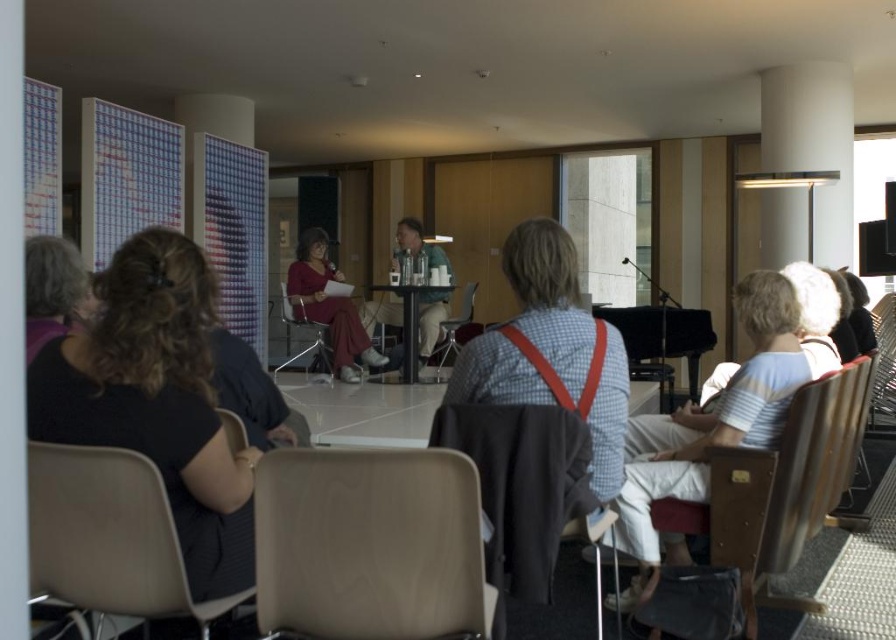
You are an event organizer who needs to adjust the seating arrangement for the panelists. You want to place a new table between the metallic silver chair at center and the matte plastic chair at center. Is this possible?

The metallic silver chair at center is positioned under the matte plastic chair at center, so placing a table between them might not be feasible since they are vertically aligned rather than horizontally spaced apart.

You are a stagehand needing to move a 1.5 meter long extension cord from the black fabric shirt at left to the wooden chair at lower right. Can you lay the cord directly on the floor between them without bending it?

The distance between the black fabric shirt at left and the wooden chair at lower right is 2.03 meters. Since the extension cord is 1.5 meters long, it is shorter than the required distance. Therefore, the cord cannot reach directly between them without bending.